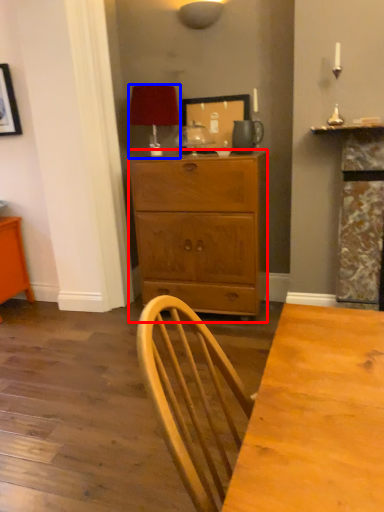
Question: Which point is further to the camera, chest of drawers (highlighted by a red box) or lamp (highlighted by a blue box)?

Choices:
 (A) chest of drawers
 (B) lamp

Answer: (B)